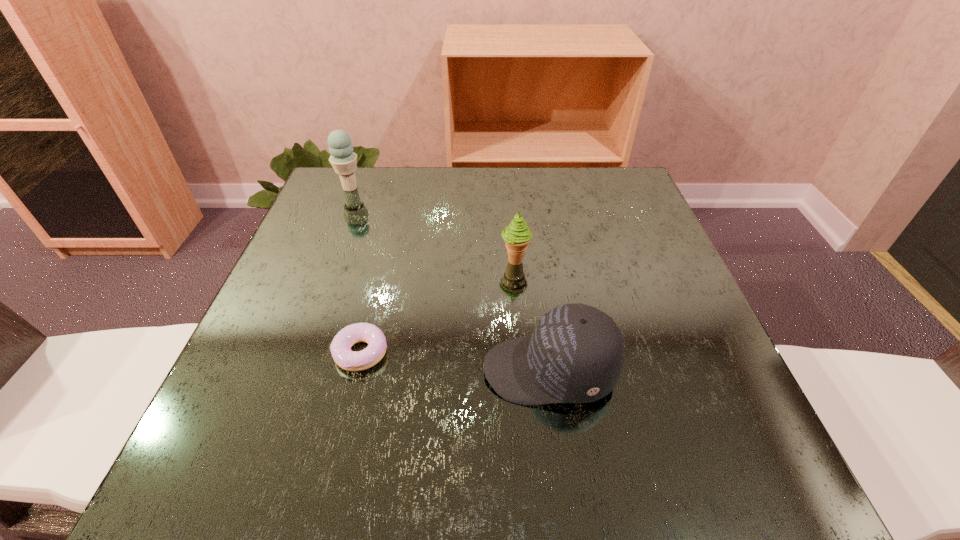
The image size is (960, 540). Identify the location of the leftmost object. (343, 159).

Where is `the tallest object`? This screenshot has width=960, height=540. the tallest object is located at coordinates (343, 159).

The width and height of the screenshot is (960, 540). Identify the location of the nearer icecream. (517, 235).

What are the coordinates of `the shorter icecream` in the screenshot? It's located at (517, 235).

The height and width of the screenshot is (540, 960). What are the coordinates of `baseball cap` in the screenshot? It's located at (575, 354).

Locate an element on the screen. This screenshot has height=540, width=960. the shortest object is located at coordinates (344, 357).

Locate an element on the screen. The height and width of the screenshot is (540, 960). the third object from right to left is located at coordinates (344, 357).

Identify the location of vacant space located 0.140m on the right of the taller icecream. The width and height of the screenshot is (960, 540). (417, 188).

Locate an element on the screen. vacant point located on the back of the second farthest object is located at coordinates (512, 224).

You are a GUI agent. You are given a task and a screenshot of the screen. Output one action in this format:
    pyautogui.click(x=<x>, y=<y>)
    Task: Click on the vacant space located 0.180m at the front of the baseball cap where the brim is located
    This screenshot has height=540, width=960.
    Given the screenshot: What is the action you would take?
    pyautogui.click(x=376, y=370)